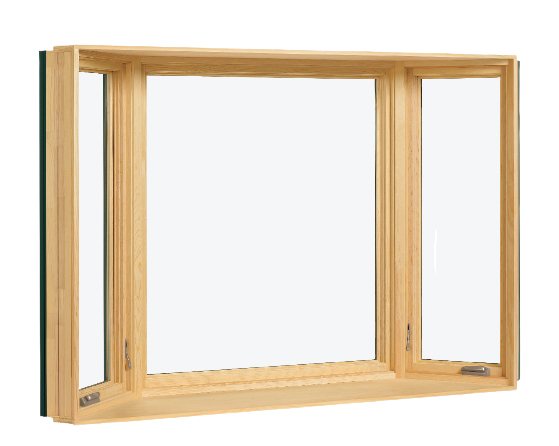
Locate an element on the screen. The image size is (559, 446). window ledge is located at coordinates (335, 391).